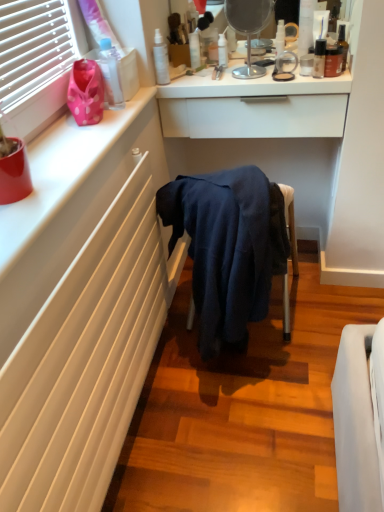
The image size is (384, 512). Identify the location of free space to the left of shiny brown bottle at upper right, the first toiletry positioned from the right. (288, 75).